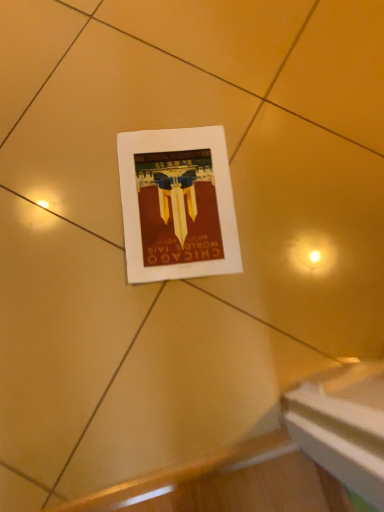
Describe the element at coordinates (177, 204) in the screenshot. I see `white paper at center` at that location.

Measure the distance between white paper at center and camera.

A distance of 29.53 inches exists between white paper at center and camera.

I want to click on white paper at center, so click(177, 204).

The image size is (384, 512). In order to click on white paper at center in this screenshot , I will do `click(177, 204)`.